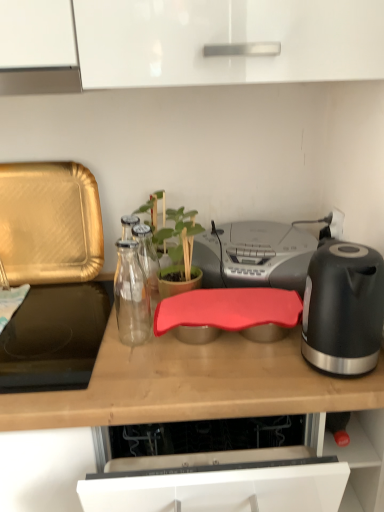
Describe the element at coordinates (49, 223) in the screenshot. This screenshot has width=384, height=512. I see `gold textured tray at left` at that location.

Measure the distance between rubberized red cutting board at center and camera.

The depth of rubberized red cutting board at center is 30.63 inches.

What do you see at coordinates (45, 458) in the screenshot? The height and width of the screenshot is (512, 384). I see `rubberized red cutting board at center` at bounding box center [45, 458].

Describe the element at coordinates (40, 80) in the screenshot. I see `metallic silver exhaust hood at upper left` at that location.

Describe the element at coordinates (173, 229) in the screenshot. I see `green matte plant at center` at that location.

You are a GUI agent. You are given a task and a screenshot of the screen. Output one action in this format:
    pyautogui.click(x=<x>, y=<y>)
    Task: Click on the black matte electric kettle at right
    
    Given the screenshot: What is the action you would take?
    pyautogui.click(x=343, y=308)

Where is `gold textured tray at left`? gold textured tray at left is located at coordinates (49, 223).

From the picture: Are black glass cooktop at left and green matte plant at center beside each other?

No, black glass cooktop at left is not in contact with green matte plant at center.

Considering their positions, is black glass cooktop at left located in front of or behind green matte plant at center?

black glass cooktop at left is in front of green matte plant at center.

From the image's perspective, is black glass cooktop at left above or below green matte plant at center?

From the image's perspective, black glass cooktop at left appears below green matte plant at center.

Is black glass cooktop at left aimed at green matte plant at center?

No, black glass cooktop at left is not oriented towards green matte plant at center.

Can we say gray plastic stereo at center lies outside black matte electric kettle at right?

That's correct, gray plastic stereo at center is outside of black matte electric kettle at right.

Does gray plastic stereo at center have a lesser height compared to black matte electric kettle at right?

Indeed, gray plastic stereo at center has a lesser height compared to black matte electric kettle at right.

From the image's perspective, does gray plastic stereo at center appear lower than black matte electric kettle at right?

No, from the image's perspective, gray plastic stereo at center is not beneath black matte electric kettle at right.

Are gray plastic stereo at center and black matte electric kettle at right far apart?

gray plastic stereo at center is near black matte electric kettle at right, not far away.

Is black matte electric kettle at right positioned in front of rubberized red cutting board at center?

No, it is behind rubberized red cutting board at center.

From a real-world perspective, is black matte electric kettle at right above or below rubberized red cutting board at center?

black matte electric kettle at right is situated higher than rubberized red cutting board at center in the real world.

Considering the relative sizes of black matte electric kettle at right and rubberized red cutting board at center in the image provided, is black matte electric kettle at right wider than rubberized red cutting board at center?

In fact, black matte electric kettle at right might be narrower than rubberized red cutting board at center.

Could rubberized red cutting board at center be considered to be inside black matte electric kettle at right?

No, rubberized red cutting board at center is not inside black matte electric kettle at right.

Is gray plastic stereo at center aimed at rubberized red cutting board at center?

No, gray plastic stereo at center is not turned towards rubberized red cutting board at center.

Does gray plastic stereo at center lie behind rubberized red cutting board at center?

Yes, gray plastic stereo at center is further from the camera.

From a real-world perspective, is gray plastic stereo at center located higher than rubberized red cutting board at center?

Indeed, from a real-world perspective, gray plastic stereo at center stands above rubberized red cutting board at center.

Is gray plastic stereo at center to the left or to the right of rubberized red cutting board at center in the image?

Based on their positions, gray plastic stereo at center is located to the right of rubberized red cutting board at center.

Considering the relative sizes of black matte electric kettle at right and gray plastic stereo at center in the image provided, is black matte electric kettle at right shorter than gray plastic stereo at center?

No.

Consider the image. From a real-world perspective, which is physically below, black matte electric kettle at right or gray plastic stereo at center?

From a 3D spatial view, gray plastic stereo at center is below.

Could you tell me if black matte electric kettle at right is facing gray plastic stereo at center?

No.

From the image's perspective, between black matte electric kettle at right and gray plastic stereo at center, who is located below?

black matte electric kettle at right appears lower in the image.

Are gold textured tray at left and black glass cooktop at left making contact?

No, gold textured tray at left is not next to black glass cooktop at left.

Between gold textured tray at left and black glass cooktop at left, which one has less height?

black glass cooktop at left.

Is gold textured tray at left in front of or behind black glass cooktop at left in the image?

gold textured tray at left is positioned farther from the viewer than black glass cooktop at left.

Is gold textured tray at left oriented away from black glass cooktop at left?

That's not correct — gold textured tray at left is not looking away from black glass cooktop at left.

This screenshot has width=384, height=512. In order to click on plant that appears below the black matte electric kettle at right (from a real-world perspective) in this screenshot , I will do `click(173, 229)`.

Is green matte plant at center far away from black matte electric kettle at right?

No, green matte plant at center is in close proximity to black matte electric kettle at right.

From the image's perspective, does green matte plant at center appear higher than black matte electric kettle at right?

Correct, green matte plant at center appears higher than black matte electric kettle at right in the image.

Which of these two, green matte plant at center or black matte electric kettle at right, stands shorter?

Standing shorter between the two is black matte electric kettle at right.

Where is `gas stove below the green matte plant at center (from the image's perspective)`? Image resolution: width=384 pixels, height=512 pixels. gas stove below the green matte plant at center (from the image's perspective) is located at coordinates (54, 338).

Locate an element on the screen. The width and height of the screenshot is (384, 512). stereo that is under the black matte electric kettle at right (from a real-world perspective) is located at coordinates (254, 255).

From the image, which object appears to be farther from black matte electric kettle at right, black glass cooktop at left or metallic silver exhaust hood at upper left?

metallic silver exhaust hood at upper left.

Which object lies nearer to the anchor point green matte plant at center, black matte electric kettle at right or gold textured tray at left?

gold textured tray at left is positioned closer to the anchor green matte plant at center.

When comparing their distances from metallic silver exhaust hood at upper left, does gold textured tray at left or rubberized red cutting board at center seem further?

rubberized red cutting board at center is further to metallic silver exhaust hood at upper left.

Looking at the image, which one is located closer to gray plastic stereo at center, green matte plant at center or rubberized red cutting board at center?

green matte plant at center is closer to gray plastic stereo at center.

Considering their positions, is green matte plant at center positioned further to gold textured tray at left than rubberized red cutting board at center?

rubberized red cutting board at center lies further to gold textured tray at left than the other object.

Consider the image. Estimate the real-world distances between objects in this image. Which object is closer to black glass cooktop at left, rubberized red cutting board at center or gray plastic stereo at center?

rubberized red cutting board at center is closer to black glass cooktop at left.

Looking at the image, which one is located closer to rubberized red cutting board at center, gold textured tray at left or gray plastic stereo at center?

gray plastic stereo at center is closer to rubberized red cutting board at center.

Estimate the real-world distances between objects in this image. Which object is closer to gray plastic stereo at center, metallic silver exhaust hood at upper left or rubberized red cutting board at center?

rubberized red cutting board at center.

This screenshot has width=384, height=512. In order to click on plant between metallic silver exhaust hood at upper left and black matte electric kettle at right in this screenshot , I will do `click(173, 229)`.

The image size is (384, 512). I want to click on gas stove between metallic silver exhaust hood at upper left and rubberized red cutting board at center in the up-down direction, so click(54, 338).

Locate an element on the screen. exhaust hood located between black glass cooktop at left and gray plastic stereo at center in the left-right direction is located at coordinates (x=40, y=80).

Find the location of a particular element. The width and height of the screenshot is (384, 512). countertop situated between gold textured tray at left and black matte electric kettle at right from left to right is located at coordinates (45, 458).